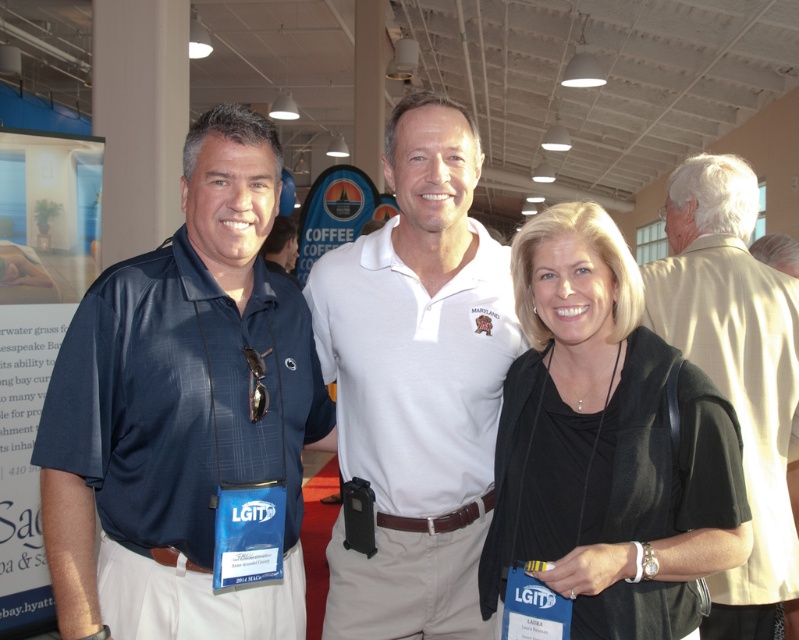
Question: Can you confirm if black matte shirt at center is positioned to the left of beige textured shirt at upper right?

Choices:
 (A) no
 (B) yes

Answer: (B)

Question: Observing the image, what is the correct spatial positioning of matte blue shirt at center in reference to black matte shirt at center?

Choices:
 (A) right
 (B) left

Answer: (B)

Question: Which object is positioned closest to the beige textured shirt at upper right?

Choices:
 (A) white cotton polo shirt at center
 (B) black matte shirt at center

Answer: (B)

Question: Among these points, which one is nearest to the camera?

Choices:
 (A) (726, 224)
 (B) (411, 557)

Answer: (B)

Question: Is matte blue shirt at center above beige textured shirt at upper right?

Choices:
 (A) yes
 (B) no

Answer: (A)

Question: Which of the following is the farthest from the observer?

Choices:
 (A) (118, 541)
 (B) (505, 529)
 (C) (446, 120)
 (D) (746, 477)

Answer: (D)